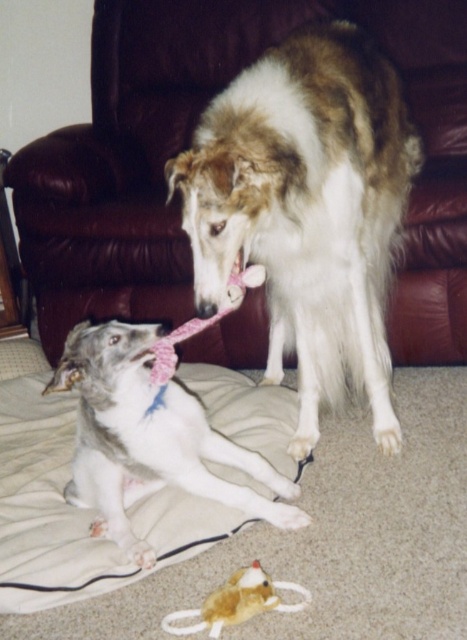
You are a dog owner who wants to place a new dog bed for your pets. The bed must be placed near the brown leather armchair at upper center and the pink fabric neckband at center. Considering their sizes, which object should the bed be placed closer to?

The bed should be placed closer to the brown leather armchair at upper center because it has a larger size compared to the pink fabric neckband at center, making it more suitable for accommodating a dog bed nearby.